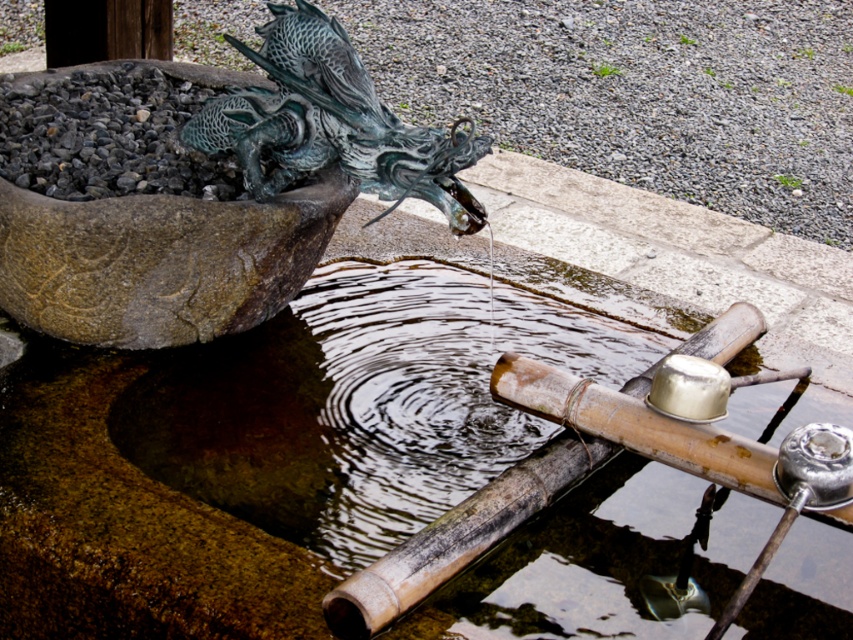
You are standing in front of a traditional Japanese water feature. You see a brown bamboo water feature at center and a green patina metal dragon at upper left. Which object is located to the right of the other?

The brown bamboo water feature at center is positioned on the right side of green patina metal dragon at upper left, so the brown bamboo water feature at center is to the right of the green patina metal dragon at upper left.